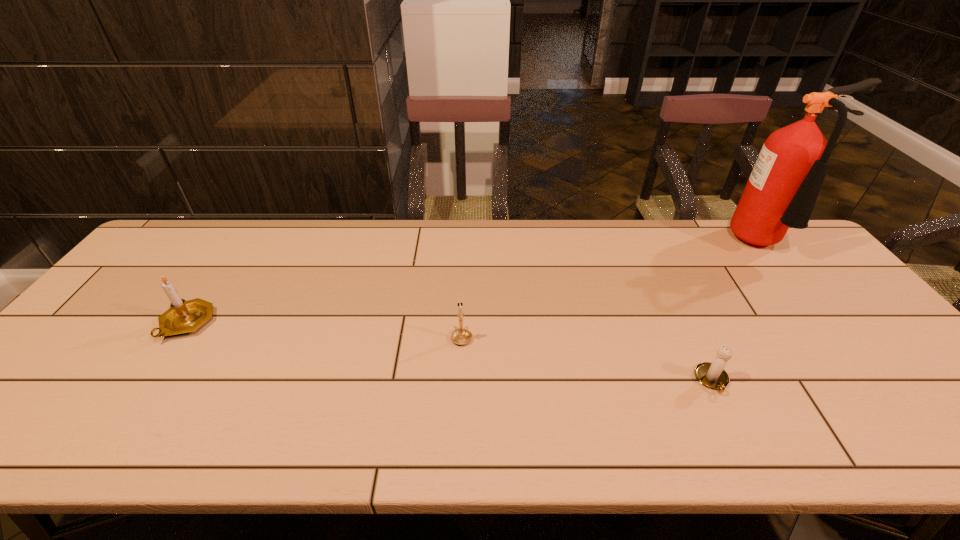
Locate an element on the screen. Image resolution: width=960 pixels, height=540 pixels. vacant space at the far left corner of the desktop is located at coordinates (205, 233).

Identify the location of vacant space at the far right corner of the desktop. (762, 251).

Where is `vacant area that lies between the second candle holder from left to right and the second object from right to left`? The width and height of the screenshot is (960, 540). vacant area that lies between the second candle holder from left to right and the second object from right to left is located at coordinates (587, 359).

Find the location of a particular element. free spot between the second candle holder from left to right and the leftmost object is located at coordinates (324, 330).

Where is `vacant area between the fire extinguisher and the leftmost object`? The height and width of the screenshot is (540, 960). vacant area between the fire extinguisher and the leftmost object is located at coordinates (477, 284).

Locate an element on the screen. This screenshot has width=960, height=540. unoccupied area between the second candle holder from right to left and the farthest object is located at coordinates (614, 291).

Locate an element on the screen. Image resolution: width=960 pixels, height=540 pixels. vacant space in between the fire extinguisher and the second object from left to right is located at coordinates (614, 291).

Locate an element on the screen. The image size is (960, 540). vacant area between the rightmost object and the third shortest object is located at coordinates (477, 284).

Image resolution: width=960 pixels, height=540 pixels. I want to click on free space between the nearest candle holder and the leftmost candle holder, so click(449, 352).

Identify the location of empty space that is in between the leftmost object and the second candle holder from left to right. pos(324,330).